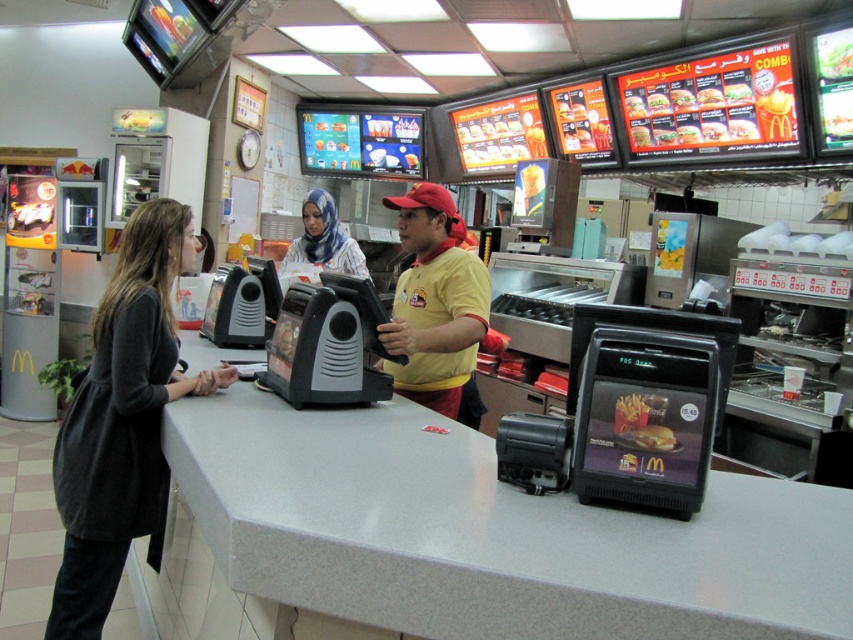
Does gray laminate counter at center have a greater width compared to golden crispy french fries at center?

Correct, the width of gray laminate counter at center exceeds that of golden crispy french fries at center.

Who is more forward, (194, 365) or (648, 445)?

Point (648, 445) is more forward.

Which is behind, point (332, 481) or point (653, 449)?

The point (332, 481) is more distant.

At what (x,y) coordinates should I click in order to perform the action: click on gray laminate counter at center. Please return your answer as a coordinate pair (x, y). The height and width of the screenshot is (640, 853). Looking at the image, I should click on (466, 540).

Which of these two, blue printed hijab at center or golden crispy chicken at center, stands shorter?

golden crispy chicken at center is shorter.

Measure the distance between point (312,209) and camera.

They are 3.75 meters apart.

This screenshot has width=853, height=640. Find the location of `blue printed hijab at center`. blue printed hijab at center is located at coordinates (323, 240).

This screenshot has height=640, width=853. Find the location of `blue printed hijab at center`. blue printed hijab at center is located at coordinates (323, 240).

Does blue printed hijab at center appear under golden crispy french fries at center?

Incorrect, blue printed hijab at center is not positioned below golden crispy french fries at center.

Is blue printed hijab at center to the right of golden crispy french fries at center from the viewer's perspective?

Incorrect, blue printed hijab at center is not on the right side of golden crispy french fries at center.

Is point (316, 243) farther from camera compared to point (647, 433)?

Yes, point (316, 243) is farther from viewer.

At what (x,y) coordinates should I click in order to perform the action: click on blue printed hijab at center. Please return your answer as a coordinate pair (x, y). This screenshot has height=640, width=853. Looking at the image, I should click on (323, 240).